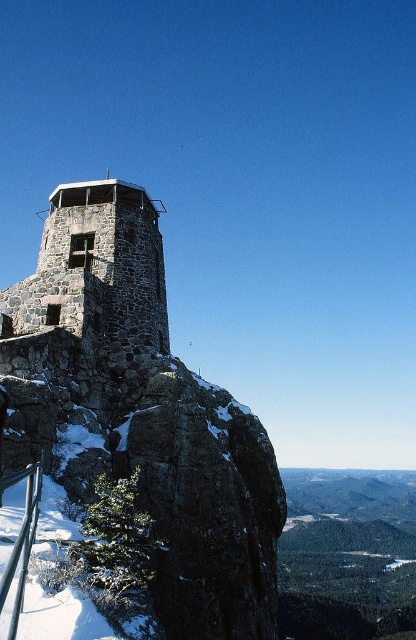
You are a hiker who has reached the summit of a mountain. You see a point marked at coordinates (96, 268). What does this point indicate?

The point at coordinates (96, 268) marks the location of the rustic stone tower at center.

You are standing at the base of the mountain looking up at the stone fire lookout tower. There are two points marked on the tower structure. The first is at coordinate point (66, 336) and the second is at point (20, 480). Which point is closer to your current position?

Point (66, 336) is further to the camera than point (20, 480), so the point closer to your current position is point (20, 480).